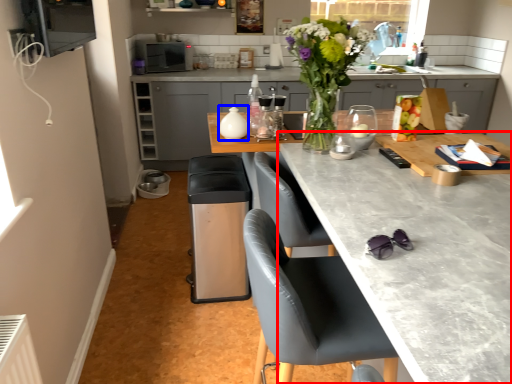
Question: Which object is further to the camera taking this photo, countertop (highlighted by a red box) or appliance (highlighted by a blue box)?

Choices:
 (A) countertop
 (B) appliance

Answer: (B)